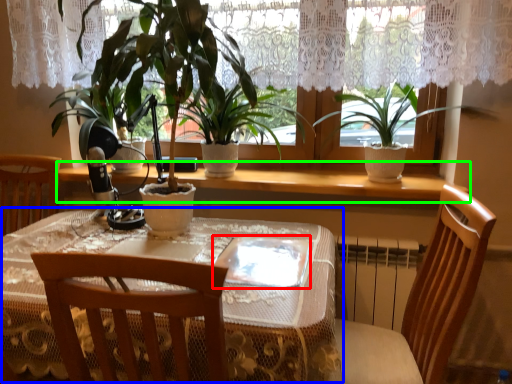
Question: Based on their relative distances, which object is farther from glass plate (highlighted by a red box)? Choose from table (highlighted by a blue box) and window sill (highlighted by a green box).

Choices:
 (A) table
 (B) window sill

Answer: (B)